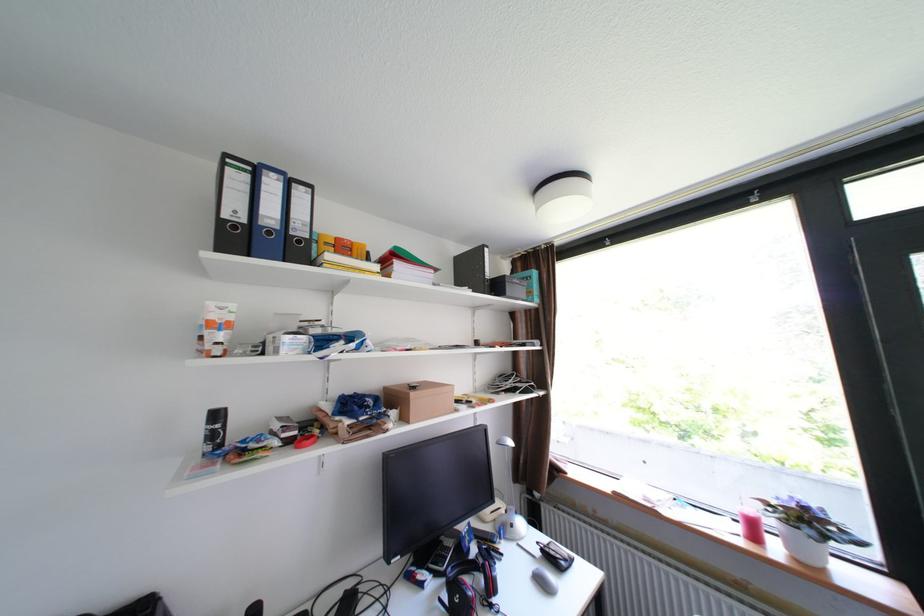
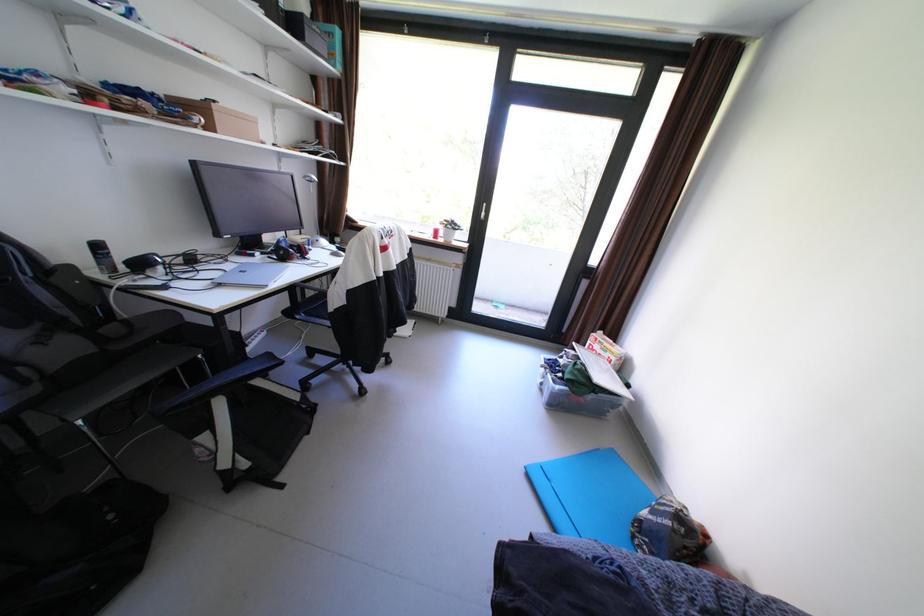
The point at (446, 576) is marked in the first image. Where is the corresponding point in the second image?

(274, 254)